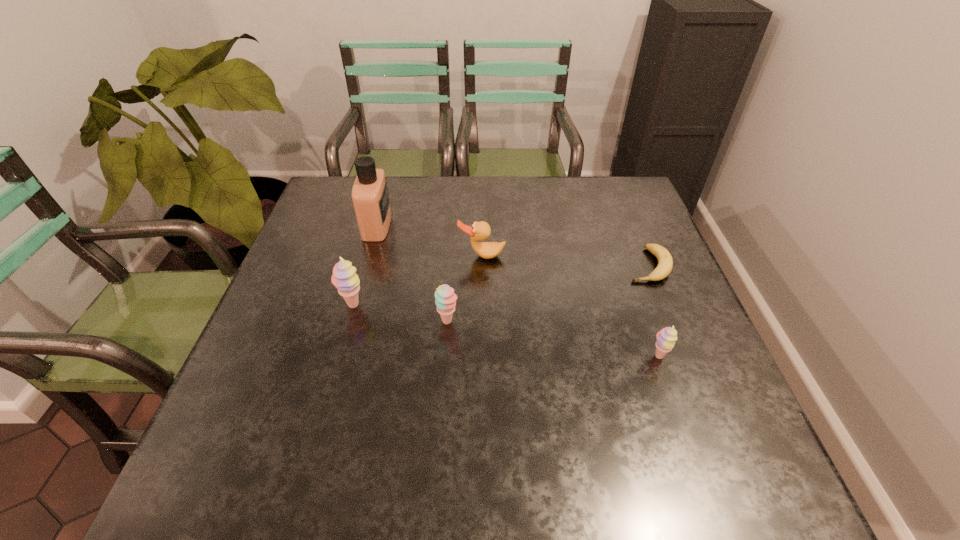
Identify the location of vacant area situated on the right of the second shortest sherbert. The height and width of the screenshot is (540, 960). (580, 321).

Identify the location of vacant space located on the back of the shortest sherbert. (627, 268).

In order to click on vacant space located 0.120m on the front of the banana in this screenshot , I will do `click(670, 321)`.

The height and width of the screenshot is (540, 960). Identify the location of vacant area located 0.240m on the front label of the tallest object. pos(473,225).

Locate an element on the screen. vacant region located 0.150m on the beak of the duck is located at coordinates (482, 305).

This screenshot has width=960, height=540. What are the coordinates of `object present at the far edge` in the screenshot? It's located at (370, 197).

You are a GUI agent. You are given a task and a screenshot of the screen. Output one action in this format:
    pyautogui.click(x=<x>, y=<y>)
    Task: Click on the object located at the left edge
    The width and height of the screenshot is (960, 540).
    Given the screenshot: What is the action you would take?
    pyautogui.click(x=370, y=197)

Find the location of a particular element. sherbert that is at the right edge is located at coordinates (666, 338).

Locate an element on the screen. The image size is (960, 540). banana at the right edge is located at coordinates (665, 263).

The width and height of the screenshot is (960, 540). In order to click on object that is at the far left corner in this screenshot , I will do `click(370, 197)`.